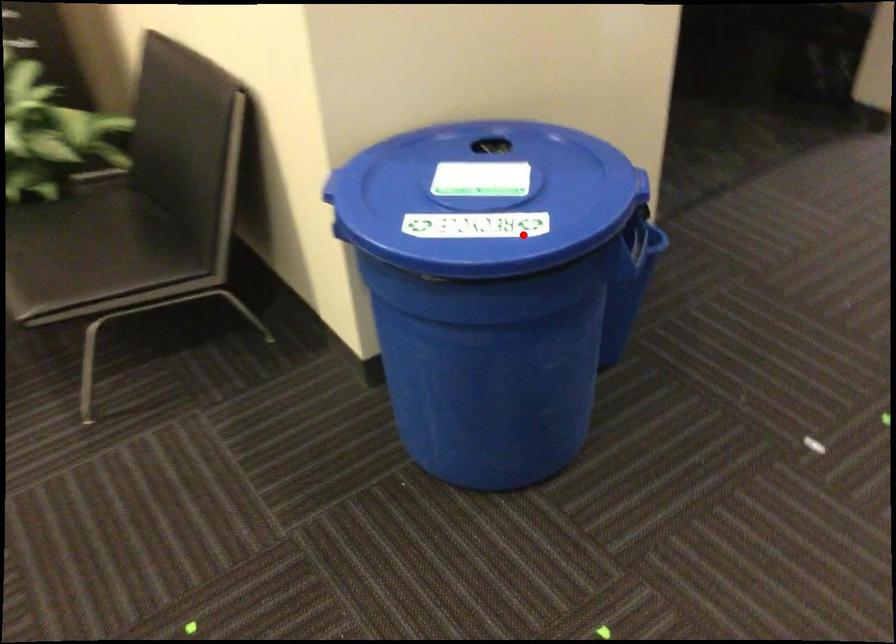
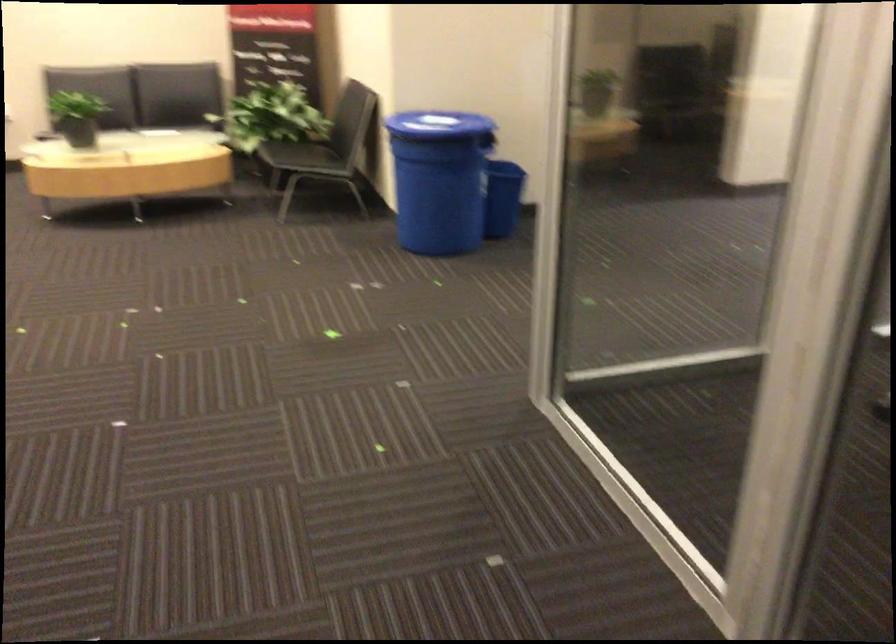
Where in the second image is the point corresponding to the highlighted location from the first image?

(438, 124)